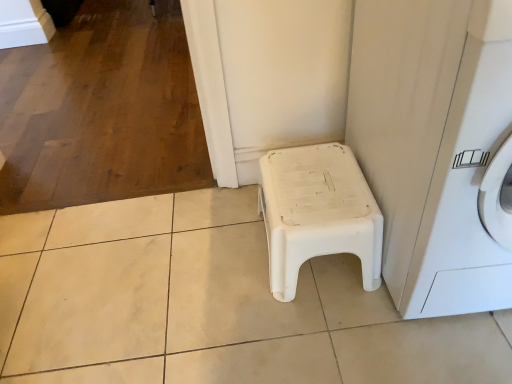
Question: Is white plastic stool at center spatially inside white plastic washing machine at lower right, or outside of it?

Choices:
 (A) outside
 (B) inside

Answer: (A)

Question: Considering the positions of point (321, 168) and point (489, 18), is point (321, 168) closer or farther from the camera than point (489, 18)?

Choices:
 (A) farther
 (B) closer

Answer: (A)

Question: Based on their positions, is white plastic stool at center located to the left or right of white plastic washing machine at lower right?

Choices:
 (A) right
 (B) left

Answer: (B)

Question: Is white plastic washing machine at lower right inside or outside of white plastic stool at center?

Choices:
 (A) inside
 (B) outside

Answer: (B)

Question: Considering the positions of white plastic washing machine at lower right and white plastic stool at center in the image, is white plastic washing machine at lower right wider or thinner than white plastic stool at center?

Choices:
 (A) thin
 (B) wide

Answer: (B)

Question: From their relative heights in the image, would you say white plastic washing machine at lower right is taller or shorter than white plastic stool at center?

Choices:
 (A) tall
 (B) short

Answer: (A)

Question: From the image's perspective, is white plastic washing machine at lower right positioned above or below white plastic stool at center?

Choices:
 (A) above
 (B) below

Answer: (A)